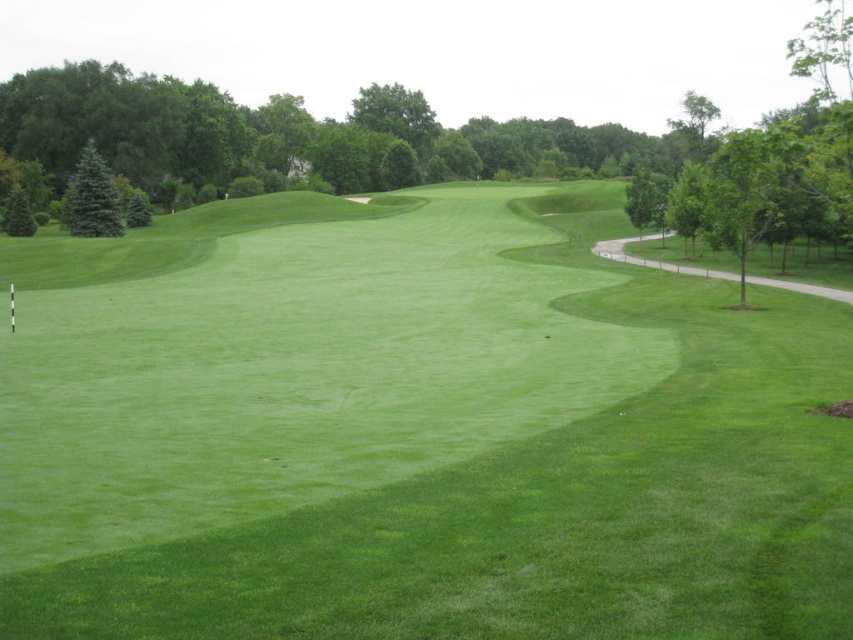
Looking at this image, you are a golfer standing on the green leafy tree at left and want to hit a ball to the green smooth grass at center. Which direction should you hit the ball to reach your target?

You should hit the ball to the right because the green smooth grass at center is located to the right of the green leafy tree at left.